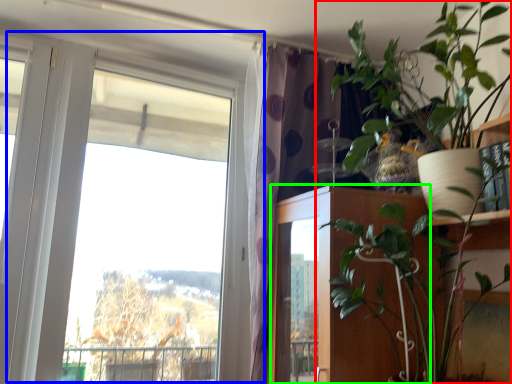
Question: Considering the real-world distances, which object is farthest from houseplant (highlighted by a red box)? window (highlighted by a blue box) or door (highlighted by a green box)?

Choices:
 (A) window
 (B) door

Answer: (A)